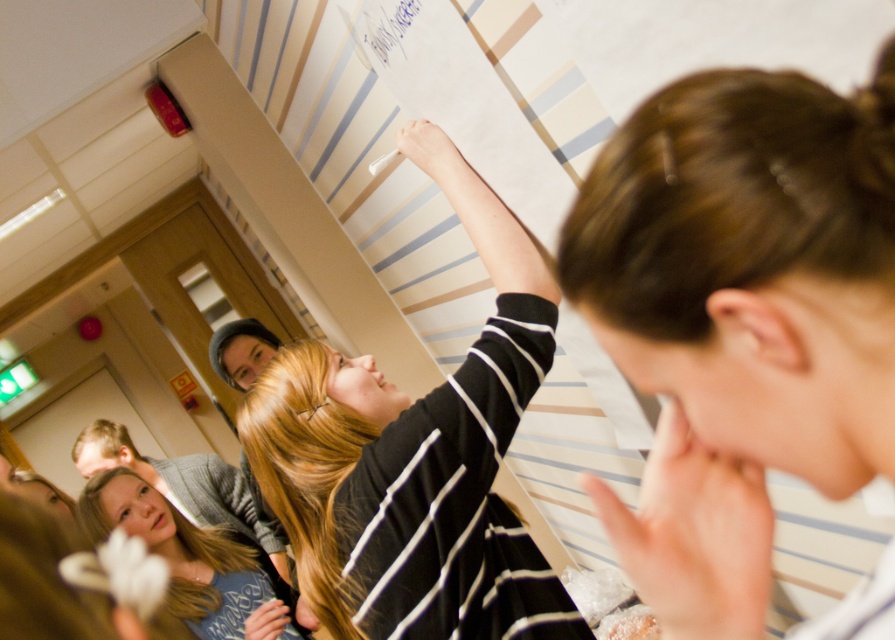
You are a GUI agent. You are given a task and a screenshot of the screen. Output one action in this format:
    pyautogui.click(x=<x>, y=<y>)
    Task: Click on the brown hair at upper right
    
    Given the screenshot: What is the action you would take?
    pyautogui.click(x=740, y=317)

This screenshot has width=895, height=640. What are the coordinates of `brown hair at upper right` in the screenshot? It's located at (740, 317).

Is black striped sweater at upper center above blue ink writing at upper center?

Incorrect, black striped sweater at upper center is not positioned above blue ink writing at upper center.

You are a GUI agent. You are given a task and a screenshot of the screen. Output one action in this format:
    pyautogui.click(x=<x>, y=<y>)
    Task: Click on the black striped sweater at upper center
    
    Given the screenshot: What is the action you would take?
    pyautogui.click(x=416, y=458)

Does point (473, 538) come behind point (379, 8)?

That is False.

Locate an element on the screen. Image resolution: width=895 pixels, height=640 pixels. black striped sweater at upper center is located at coordinates (416, 458).

Consider the image. Between brown hair at upper right and black striped sweater at upper center, which one appears on the right side from the viewer's perspective?

brown hair at upper right is more to the right.

Between brown hair at upper right and black striped sweater at upper center, which one is positioned higher?

Positioned higher is brown hair at upper right.

This screenshot has width=895, height=640. Describe the element at coordinates (740, 317) in the screenshot. I see `brown hair at upper right` at that location.

Locate an element on the screen. brown hair at upper right is located at coordinates (740, 317).